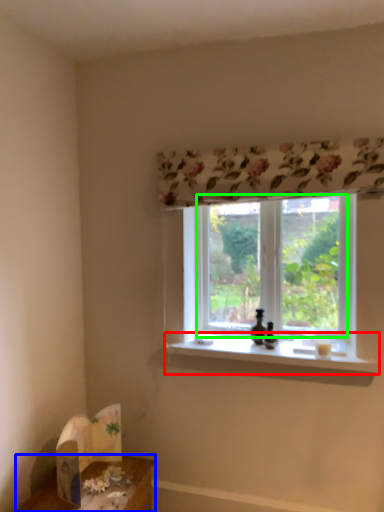
Question: Which is farther away from window sill (highlighted by a red box)? table (highlighted by a blue box) or window screen (highlighted by a green box)?

Choices:
 (A) table
 (B) window screen

Answer: (A)